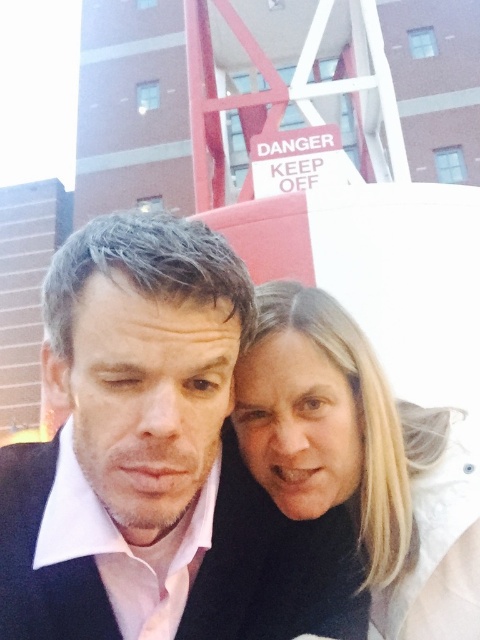
You are a photographer trying to capture a photo of the two people in the scene. Since the blonde hair at center and the black matte business suit at center are both in the frame, which one will appear bigger in your photo?

The blonde hair at center will appear bigger in the photo because it has a larger size compared to the black matte business suit at center.

You are a photographer trying to capture a candid shot of the two people in the scene. You notice that the pink matte shirt at center and the blonde hair at center are positioned in a way that might block each other. Based on their heights, which one is more likely to be visible in the photo if you aim your camera at the center of the scene?

The pink matte shirt at center is taller than blonde hair at center, so the pink matte shirt at center will be more visible in the photo.